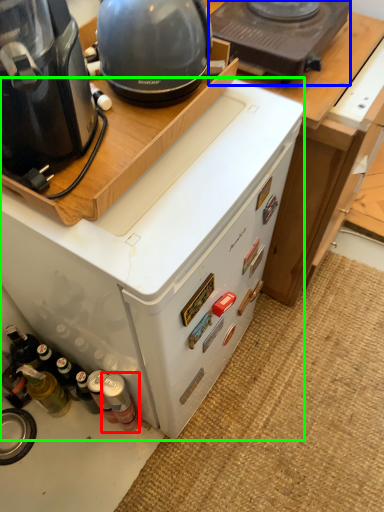
Question: Which object is the closest to the bottle (highlighted by a red box)? Choose among these: kitchen appliance (highlighted by a blue box) or home appliance (highlighted by a green box).

Choices:
 (A) kitchen appliance
 (B) home appliance

Answer: (B)